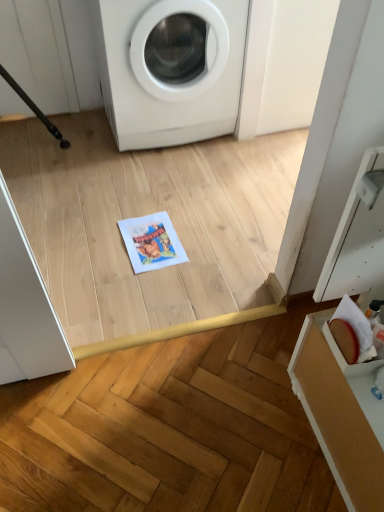
Question: Is white glossy washing machine at upper center thinner than printed paper at center?

Choices:
 (A) no
 (B) yes

Answer: (A)

Question: Is white glossy washing machine at upper center bigger than printed paper at center?

Choices:
 (A) yes
 (B) no

Answer: (A)

Question: Does white glossy washing machine at upper center have a greater width compared to printed paper at center?

Choices:
 (A) yes
 (B) no

Answer: (A)

Question: Can you confirm if white glossy washing machine at upper center is shorter than printed paper at center?

Choices:
 (A) yes
 (B) no

Answer: (B)

Question: Is white glossy washing machine at upper center outside printed paper at center?

Choices:
 (A) yes
 (B) no

Answer: (A)

Question: Would you say white glossy washing machine at upper center contains printed paper at center?

Choices:
 (A) no
 (B) yes

Answer: (A)

Question: Is printed paper at center touching white glossy washing machine at upper center?

Choices:
 (A) no
 (B) yes

Answer: (A)

Question: From a real-world perspective, is printed paper at center over white glossy washing machine at upper center?

Choices:
 (A) yes
 (B) no

Answer: (B)

Question: Does printed paper at center have a lesser height compared to white glossy washing machine at upper center?

Choices:
 (A) yes
 (B) no

Answer: (A)

Question: Is printed paper at center to the right of white glossy washing machine at upper center from the viewer's perspective?

Choices:
 (A) yes
 (B) no

Answer: (B)

Question: Considering the relative positions of printed paper at center and white glossy washing machine at upper center in the image provided, is printed paper at center to the left of white glossy washing machine at upper center from the viewer's perspective?

Choices:
 (A) yes
 (B) no

Answer: (A)

Question: Considering the relative sizes of printed paper at center and white glossy washing machine at upper center in the image provided, is printed paper at center wider than white glossy washing machine at upper center?

Choices:
 (A) yes
 (B) no

Answer: (B)

Question: In the image, is printed paper at center on the left side or the right side of white glossy washing machine at upper center?

Choices:
 (A) left
 (B) right

Answer: (A)